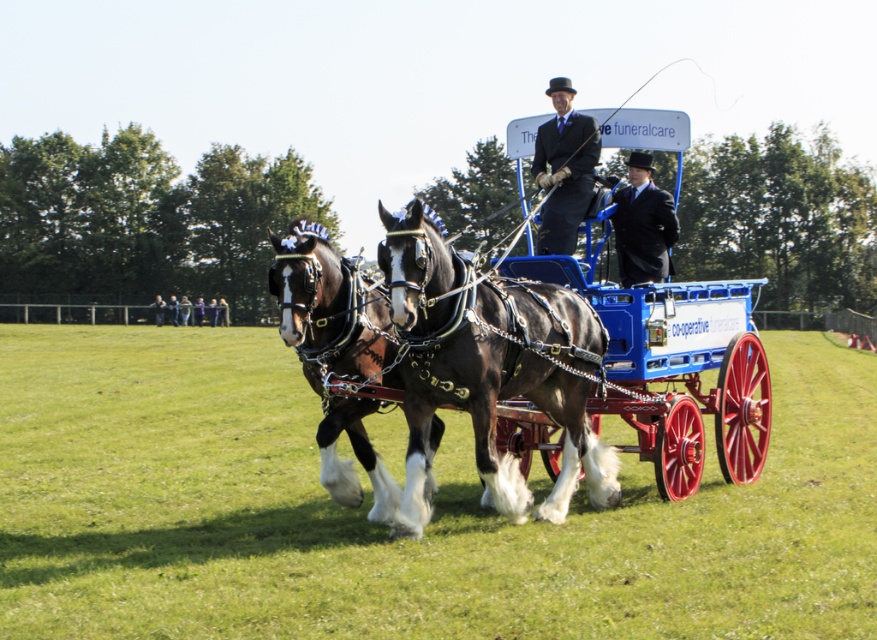
You are a photographer positioned behind the two subjects. You need to capture a wide shot that includes both the brown glossy horse at center and the dark blue suit at center. Given that your camera has a fixed width, which subject should you position closer to the camera to ensure both fit in the frame?

To ensure both the brown glossy horse at center and the dark blue suit at center fit in the frame, position the brown glossy horse at center closer to the camera. Since the brown glossy horse at center is wider than the dark blue suit at center, moving it closer will help maintain their relative sizes within the fixed width of the camera frame.

You are standing in the grassy field and see the shiny blue cart at center and the black wool coat at center. Which object is positioned to the left?

The shiny blue cart at center is to the left of the black wool coat at center.

You are attending a funeral and need to sit between the matte black suit at center and the smooth leather jacket at center. Which side should you choose to ensure there is enough space for both of you?

The matte black suit at center is wider than the smooth leather jacket at center. Therefore, you should sit on the side of the smooth leather jacket at center to ensure there is enough space for both of you.